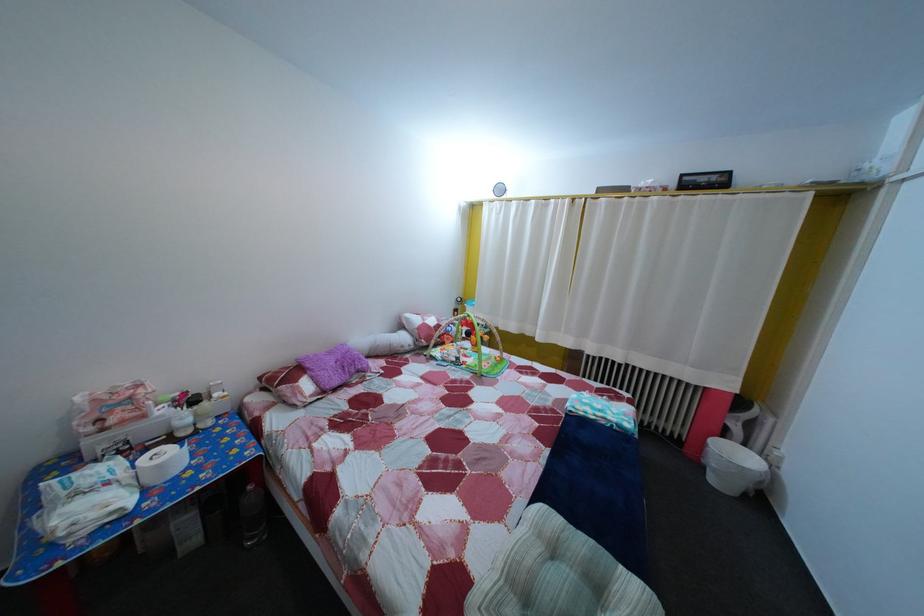
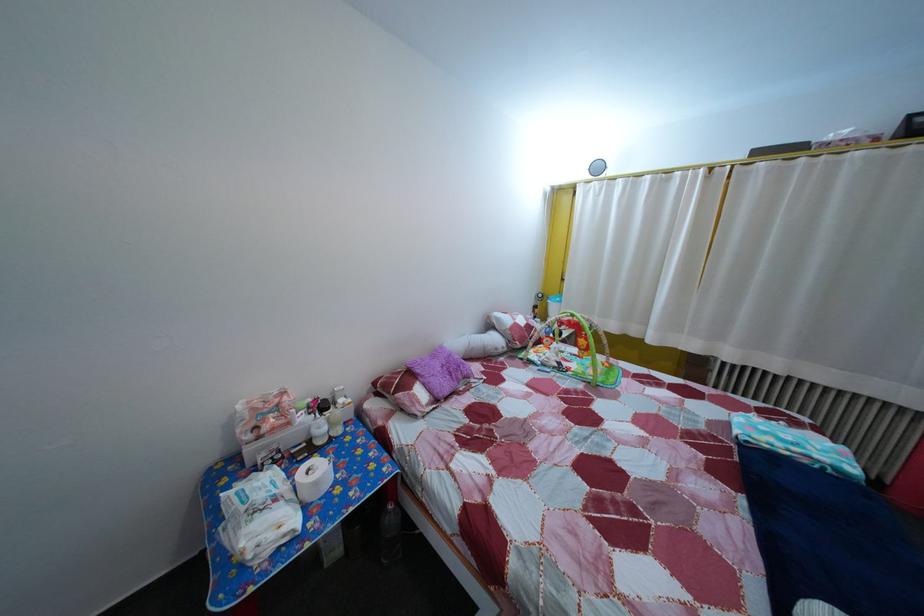
Where in the second image is the point corresponding to (542,209) from the first image?

(659, 185)